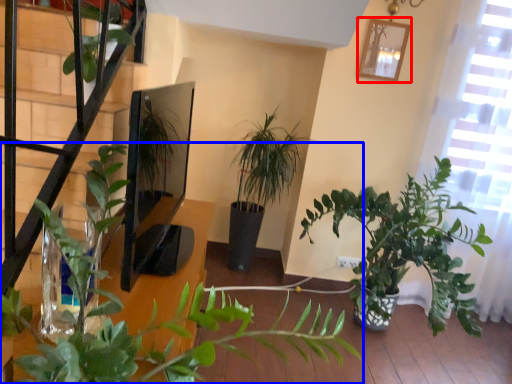
Question: Which object is further to the camera taking this photo, picture frame (highlighted by a red box) or houseplant (highlighted by a blue box)?

Choices:
 (A) picture frame
 (B) houseplant

Answer: (A)